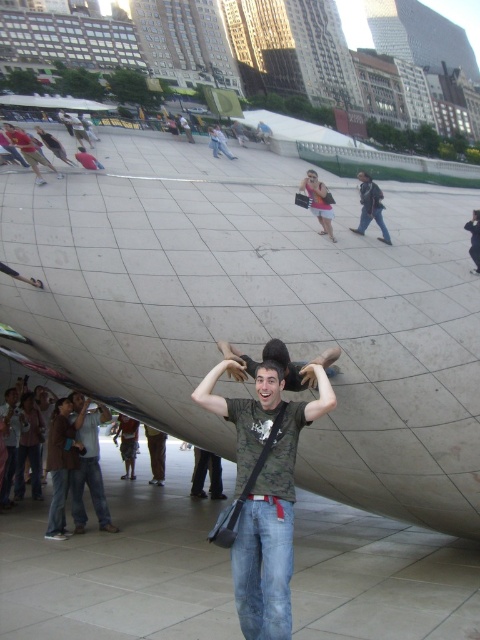
Which is below, denim jeans at lower left or pink fabric skirt at center?

denim jeans at lower left

Who is more distant from viewer, [84,461] or [328,230]?

The point [84,461] is behind.

Where is `denim jeans at lower left`? The image size is (480, 640). denim jeans at lower left is located at coordinates (88, 465).

Does dark green t-shirt at center come behind denim jeans at lower left?

No.

Is point (252, 589) closer to camera compared to point (106, 500)?

Yes, it is.

Image resolution: width=480 pixels, height=640 pixels. I want to click on dark green t-shirt at center, so click(274, 524).

Which of these two, dark green t-shirt at center or pink fabric skirt at center, stands taller?

Standing taller between the two is dark green t-shirt at center.

Is point (238, 492) more distant than point (312, 189)?

That is False.

Which is behind, point (305, 404) or point (319, 200)?

Positioned behind is point (319, 200).

Locate an element on the screen. The height and width of the screenshot is (640, 480). dark green t-shirt at center is located at coordinates (274, 524).